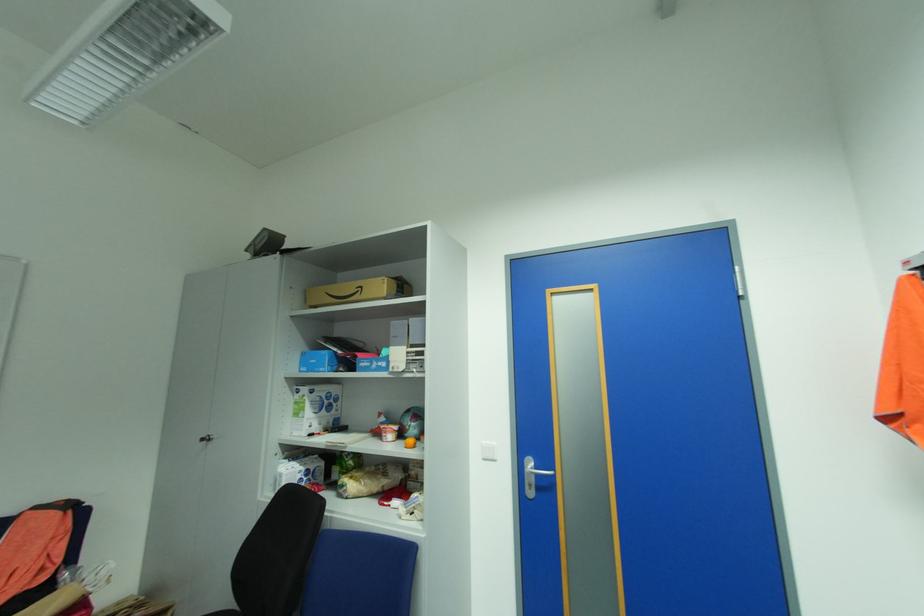
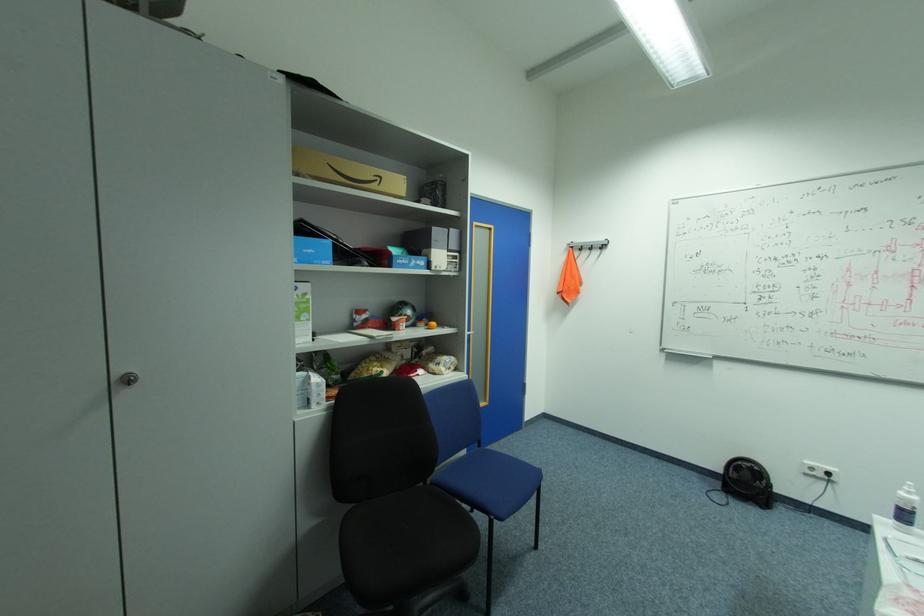
In the second image, find the point that corresponds to point 327,370 in the first image.

(331, 262)